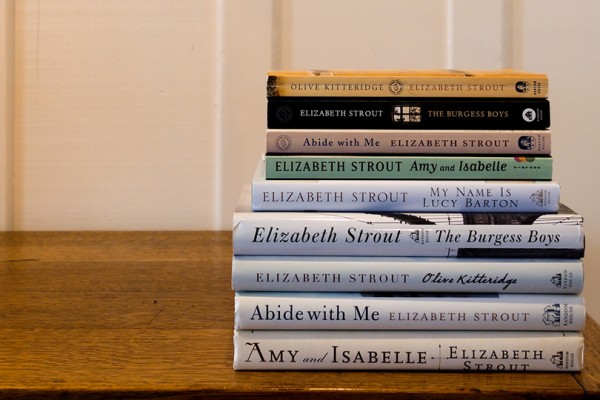
Find the location of a particular element. book is located at coordinates (379, 351), (412, 317), (448, 282), (490, 240), (478, 204), (468, 167), (442, 143), (469, 117), (484, 85).